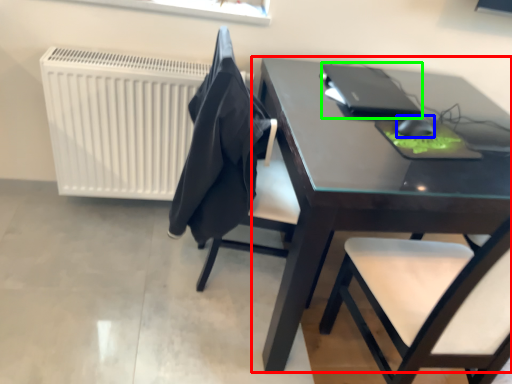
Question: Based on their relative distances, which object is nearer to table (highlighted by a red box)? Choose from mouse (highlighted by a blue box) and laptop (highlighted by a green box).

Choices:
 (A) mouse
 (B) laptop

Answer: (B)